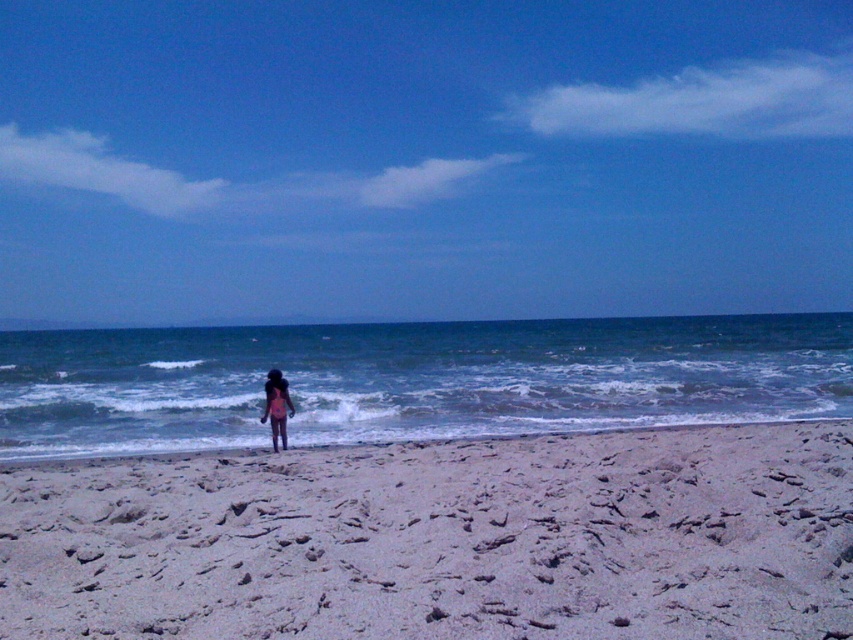
Looking at this image, is fine-grained sand at center thinner than blue water at center?

Indeed, fine-grained sand at center has a lesser width compared to blue water at center.

This screenshot has height=640, width=853. What are the coordinates of `fine-grained sand at center` in the screenshot? It's located at (442, 538).

You are a GUI agent. You are given a task and a screenshot of the screen. Output one action in this format:
    pyautogui.click(x=<x>, y=<y>)
    Task: Click on the fine-grained sand at center
    
    Given the screenshot: What is the action you would take?
    pyautogui.click(x=442, y=538)

Who is more distant from viewer, [225,544] or [276,385]?

Positioned behind is point [276,385].

The image size is (853, 640). Identify the location of fine-grained sand at center. (442, 538).

Where is `fine-grained sand at center`? The width and height of the screenshot is (853, 640). fine-grained sand at center is located at coordinates (442, 538).

This screenshot has width=853, height=640. What are the coordinates of `fine-grained sand at center` in the screenshot? It's located at point(442,538).

Between point (154, 422) and point (264, 420), which one is positioned behind?

Point (154, 422)

Which is behind, point (386, 396) or point (280, 419)?

The point (386, 396) is more distant.

At what (x,y) coordinates should I click in order to perform the action: click on blue water at center. Please return your answer as a coordinate pair (x, y). Looking at the image, I should click on (412, 380).